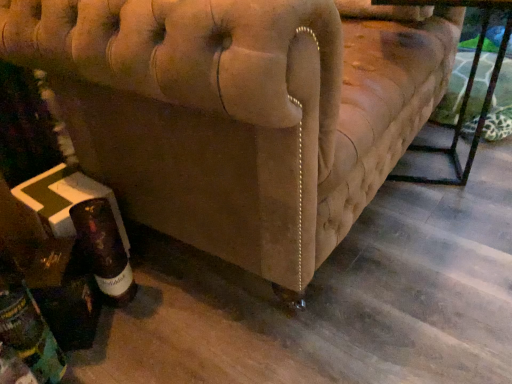
Identify the location of beige fabric couch at lower left. (239, 112).

Describe the element at coordinates (30, 335) in the screenshot. The height and width of the screenshot is (384, 512). I see `dark brown glass bottle at lower left, which is the second bottle from right to left` at that location.

Image resolution: width=512 pixels, height=384 pixels. I want to click on beige fabric couch at lower left, so click(239, 112).

Locate an element on the screen. table behind the dark brown glass bottle at lower left, the first bottle from the left is located at coordinates (465, 89).

How far apart are metallic black table at lower right and dark brown glass bottle at lower left, the first bottle from the left?

metallic black table at lower right is 1.45 meters away from dark brown glass bottle at lower left, the first bottle from the left.

Is metallic black table at lower right smaller than dark brown glass bottle at lower left, the first bottle from the left?

Actually, metallic black table at lower right might be larger than dark brown glass bottle at lower left, the first bottle from the left.

How different are the orientations of metallic black table at lower right and dark brown glass bottle at lower left, which is the second bottle from right to left, in degrees?

The angle between the facing direction of metallic black table at lower right and the facing direction of dark brown glass bottle at lower left, which is the second bottle from right to left, is 173 degrees.

Between brown glass bottle at lower left, placed as the 1th bottle when sorted from right to left, and beige fabric couch at lower left, which one has less height?

brown glass bottle at lower left, placed as the 1th bottle when sorted from right to left.

Considering the relative sizes of brown glass bottle at lower left, which appears as the second bottle when viewed from the left, and beige fabric couch at lower left in the image provided, is brown glass bottle at lower left, which appears as the second bottle when viewed from the left, thinner than beige fabric couch at lower left?

Yes, brown glass bottle at lower left, which appears as the second bottle when viewed from the left, is thinner than beige fabric couch at lower left.

From the image's perspective, is brown glass bottle at lower left, which appears as the second bottle when viewed from the left, positioned above or below beige fabric couch at lower left?

Based on their image positions, brown glass bottle at lower left, which appears as the second bottle when viewed from the left, is located beneath beige fabric couch at lower left.

Is brown glass bottle at lower left, placed as the 1th bottle when sorted from right to left, positioned in front of beige fabric couch at lower left?

No, it is not.

How far apart are dark brown glass bottle at lower left, the first bottle from the left, and brown glass bottle at lower left, placed as the 1th bottle when sorted from right to left?

dark brown glass bottle at lower left, the first bottle from the left, is 8.68 inches away from brown glass bottle at lower left, placed as the 1th bottle when sorted from right to left.

Is point (32, 299) closer to viewer compared to point (113, 229)?

Yes, point (32, 299) is in front of point (113, 229).

Which of these two, dark brown glass bottle at lower left, the first bottle from the left, or brown glass bottle at lower left, which appears as the second bottle when viewed from the left, stands taller?

Standing taller between the two is dark brown glass bottle at lower left, the first bottle from the left.

Is brown glass bottle at lower left, which appears as the second bottle when viewed from the left, a part of dark brown glass bottle at lower left, the first bottle from the left?

No, dark brown glass bottle at lower left, the first bottle from the left, does not contain brown glass bottle at lower left, which appears as the second bottle when viewed from the left.

From a real-world perspective, is metallic black table at lower right positioned under beige fabric couch at lower left based on gravity?

Correct, in the physical world, metallic black table at lower right is lower than beige fabric couch at lower left.

Which of these two, metallic black table at lower right or beige fabric couch at lower left, is wider?

With larger width is beige fabric couch at lower left.

Which point is more distant from viewer, (x=475, y=140) or (x=183, y=209)?

The point (x=475, y=140) is more distant.

From the image's perspective, which is above, dark brown glass bottle at lower left, the first bottle from the left, or metallic black table at lower right?

metallic black table at lower right.

In the scene shown: Is metallic black table at lower right at the back of dark brown glass bottle at lower left, which is the second bottle from right to left?

dark brown glass bottle at lower left, which is the second bottle from right to left, does not have its back to metallic black table at lower right.

Which object is positioned more to the right, dark brown glass bottle at lower left, the first bottle from the left, or metallic black table at lower right?

metallic black table at lower right is more to the right.

From a real-world perspective, is beige fabric couch at lower left positioned above or below metallic black table at lower right?

In terms of real-world spatial position, beige fabric couch at lower left is above metallic black table at lower right.

Does beige fabric couch at lower left have a larger size compared to metallic black table at lower right?

Indeed, beige fabric couch at lower left has a larger size compared to metallic black table at lower right.

From the image's perspective, does beige fabric couch at lower left appear lower than metallic black table at lower right?

No, from the image's perspective, beige fabric couch at lower left is not below metallic black table at lower right.

Visually, is beige fabric couch at lower left positioned to the left or to the right of metallic black table at lower right?

In the image, beige fabric couch at lower left appears on the left side of metallic black table at lower right.

How much distance is there between brown glass bottle at lower left, which appears as the second bottle when viewed from the left, and dark brown glass bottle at lower left, which is the second bottle from right to left?

brown glass bottle at lower left, which appears as the second bottle when viewed from the left, and dark brown glass bottle at lower left, which is the second bottle from right to left, are 8.68 inches apart from each other.

Considering the relative sizes of brown glass bottle at lower left, which appears as the second bottle when viewed from the left, and dark brown glass bottle at lower left, the first bottle from the left, in the image provided, is brown glass bottle at lower left, which appears as the second bottle when viewed from the left, taller than dark brown glass bottle at lower left, the first bottle from the left,?

No.

Is brown glass bottle at lower left, placed as the 1th bottle when sorted from right to left, in front of or behind dark brown glass bottle at lower left, the first bottle from the left, in the image?

Visually, brown glass bottle at lower left, placed as the 1th bottle when sorted from right to left, is located behind dark brown glass bottle at lower left, the first bottle from the left.

Does brown glass bottle at lower left, which appears as the second bottle when viewed from the left, turn towards dark brown glass bottle at lower left, which is the second bottle from right to left?

No, brown glass bottle at lower left, which appears as the second bottle when viewed from the left, is not facing towards dark brown glass bottle at lower left, which is the second bottle from right to left.

Image resolution: width=512 pixels, height=384 pixels. In order to click on bottle that is the 2nd object to the left of the metallic black table at lower right, starting at the anchor in this screenshot , I will do `click(30, 335)`.

Locate an element on the screen. the 1st bottle below the beige fabric couch at lower left (from the image's perspective) is located at coordinates (104, 250).

Looking at this image, which object lies nearer to the anchor point dark brown glass bottle at lower left, which is the second bottle from right to left, brown glass bottle at lower left, which appears as the second bottle when viewed from the left, or metallic black table at lower right?

brown glass bottle at lower left, which appears as the second bottle when viewed from the left, lies closer to dark brown glass bottle at lower left, which is the second bottle from right to left, than the other object.

Considering their positions, is metallic black table at lower right positioned closer to dark brown glass bottle at lower left, the first bottle from the left, than beige fabric couch at lower left?

The object closer to dark brown glass bottle at lower left, the first bottle from the left, is beige fabric couch at lower left.

Estimate the real-world distances between objects in this image. Which object is closer to beige fabric couch at lower left, brown glass bottle at lower left, which appears as the second bottle when viewed from the left, or dark brown glass bottle at lower left, the first bottle from the left?

brown glass bottle at lower left, which appears as the second bottle when viewed from the left.

When comparing their distances from beige fabric couch at lower left, does dark brown glass bottle at lower left, the first bottle from the left, or metallic black table at lower right seem closer?

Among the two, dark brown glass bottle at lower left, the first bottle from the left, is located nearer to beige fabric couch at lower left.

Estimate the real-world distances between objects in this image. Which object is further from dark brown glass bottle at lower left, which is the second bottle from right to left, beige fabric couch at lower left or brown glass bottle at lower left, which appears as the second bottle when viewed from the left?

beige fabric couch at lower left is positioned further to the anchor dark brown glass bottle at lower left, which is the second bottle from right to left.

In the scene shown: Estimate the real-world distances between objects in this image. Which object is further from dark brown glass bottle at lower left, which is the second bottle from right to left, beige fabric couch at lower left or metallic black table at lower right?

metallic black table at lower right is further to dark brown glass bottle at lower left, which is the second bottle from right to left.

Looking at this image, based on their spatial positions, is beige fabric couch at lower left or brown glass bottle at lower left, which appears as the second bottle when viewed from the left, further from metallic black table at lower right?

brown glass bottle at lower left, which appears as the second bottle when viewed from the left, lies further to metallic black table at lower right than the other object.

Which object lies further to the anchor point brown glass bottle at lower left, placed as the 1th bottle when sorted from right to left, dark brown glass bottle at lower left, which is the second bottle from right to left, or beige fabric couch at lower left?

beige fabric couch at lower left is positioned further to the anchor brown glass bottle at lower left, placed as the 1th bottle when sorted from right to left.

Locate an element on the screen. The image size is (512, 384). bottle between beige fabric couch at lower left and dark brown glass bottle at lower left, which is the second bottle from right to left, in the vertical direction is located at coordinates (104, 250).

The height and width of the screenshot is (384, 512). Identify the location of furniture between dark brown glass bottle at lower left, the first bottle from the left, and metallic black table at lower right from left to right. (239, 112).

In order to click on furniture located between brown glass bottle at lower left, placed as the 1th bottle when sorted from right to left, and metallic black table at lower right in the left-right direction in this screenshot , I will do `click(239, 112)`.

At what (x,y) coordinates should I click in order to perform the action: click on bottle located between dark brown glass bottle at lower left, which is the second bottle from right to left, and metallic black table at lower right in the left-right direction. Please return your answer as a coordinate pair (x, y). The image size is (512, 384). Looking at the image, I should click on (104, 250).